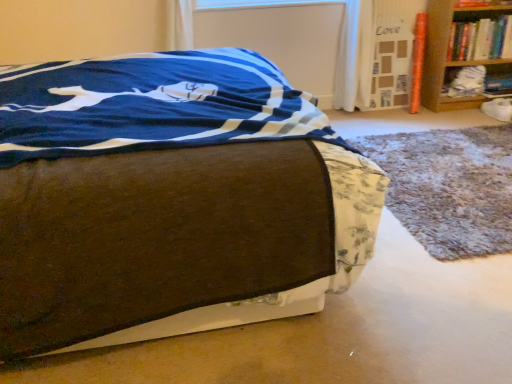
Question: From the image's perspective, is wooden bookshelf at upper right, the first shelf positioned from the right, above or below brown fabric bed at center?

Choices:
 (A) above
 (B) below

Answer: (A)

Question: In terms of width, does wooden bookshelf at upper right, marked as the 2th shelf in a left-to-right arrangement, look wider or thinner when compared to brown fabric bed at center?

Choices:
 (A) wide
 (B) thin

Answer: (B)

Question: Considering the real-world distances, which object is farthest from the white fabric at right, marked as the first shelf in a left-to-right arrangement?

Choices:
 (A) fluffy gray rug at lower right
 (B) wooden bookshelf at upper right, marked as the 2th shelf in a left-to-right arrangement
 (C) hardcover book at upper right
 (D) transparent plastic window screen at upper center
 (E) brown fabric bed at center

Answer: (E)

Question: Estimate the real-world distances between objects in this image. Which object is closer to the fluffy gray rug at lower right?

Choices:
 (A) white fabric at right, marked as the first shelf in a left-to-right arrangement
 (B) wooden bookshelf at upper right, marked as the 2th shelf in a left-to-right arrangement
 (C) transparent plastic window screen at upper center
 (D) brown fabric bed at center
 (E) hardcover book at upper right

Answer: (B)